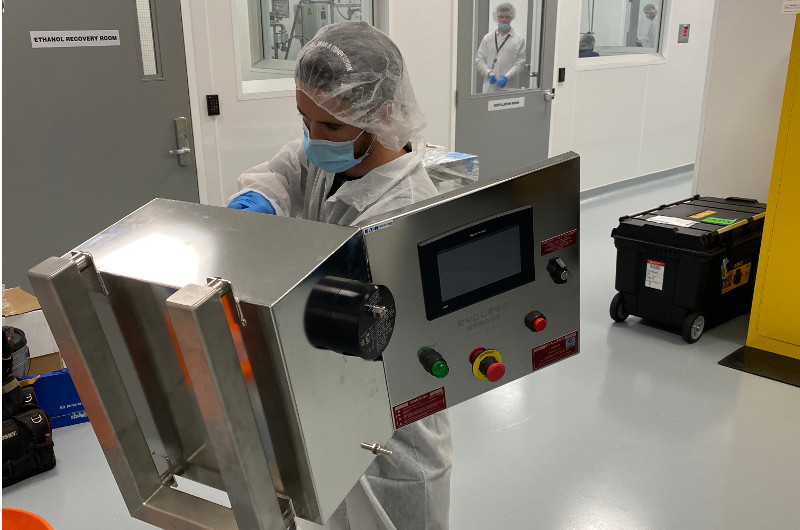
Locate an element on the screen. walls is located at coordinates (730, 128), (638, 98), (233, 129).